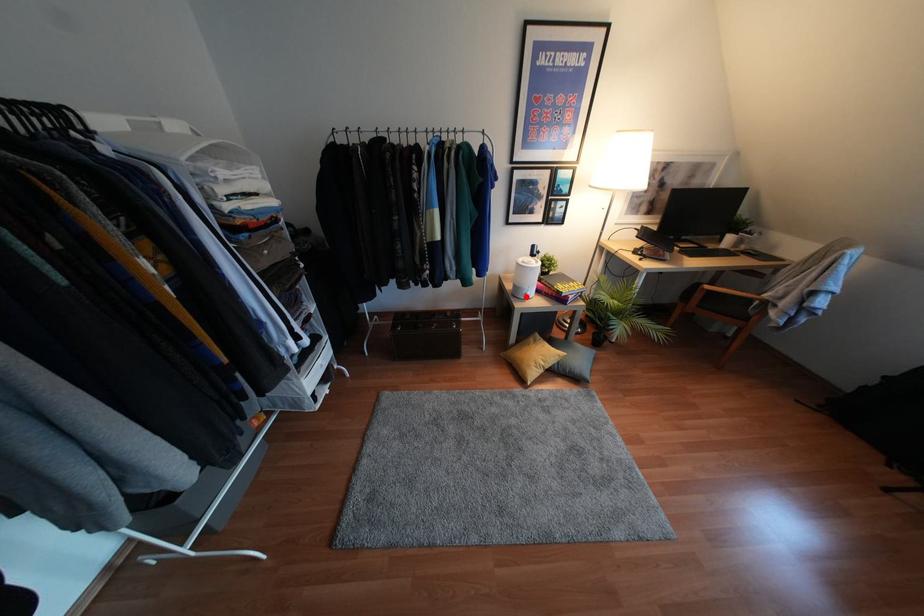
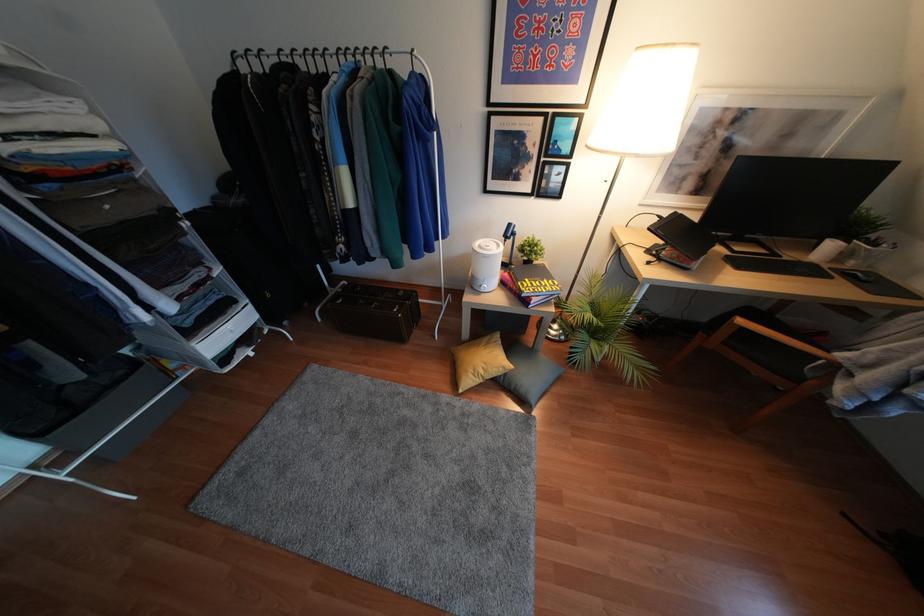
Locate, in the second image, the point that corresponds to the highlighted location in the first image.

(481, 290)